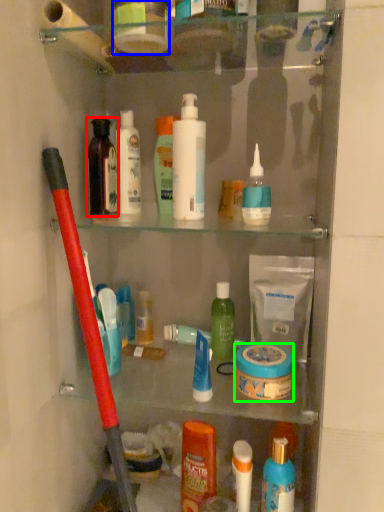
Question: Which is farther away from toiletry (highlighted by a red box)? toiletry (highlighted by a blue box) or mouthwash (highlighted by a green box)?

Choices:
 (A) toiletry
 (B) mouthwash

Answer: (B)